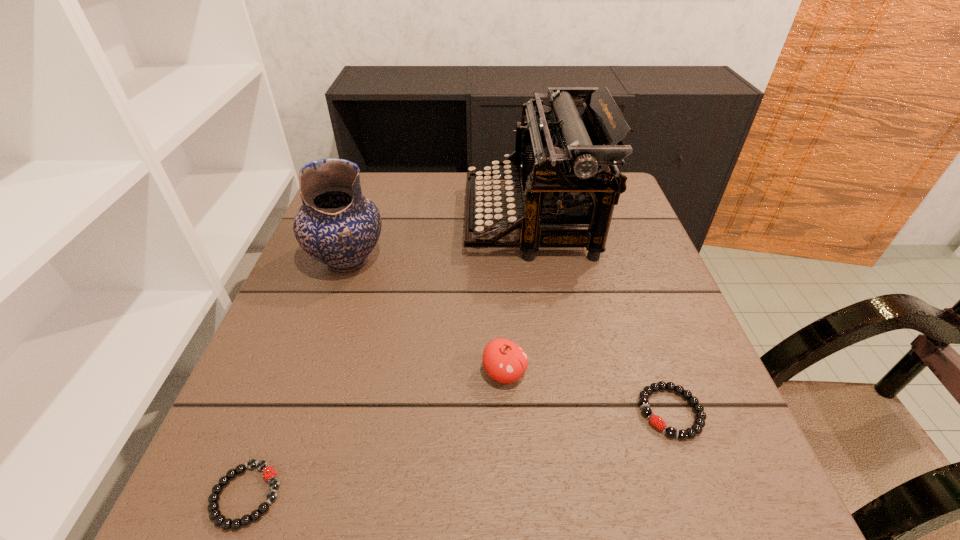
Locate an element on the screen. The height and width of the screenshot is (540, 960). free space located 0.280m on the back of the third tallest object is located at coordinates (499, 261).

Find the location of a particular element. The height and width of the screenshot is (540, 960). vacant point located on the left of the farther bracelet is located at coordinates (455, 412).

This screenshot has height=540, width=960. Find the location of `vacant space situated 0.070m on the right of the nearest object`. vacant space situated 0.070m on the right of the nearest object is located at coordinates [328, 495].

You are a GUI agent. You are given a task and a screenshot of the screen. Output one action in this format:
    pyautogui.click(x=<x>, y=<y>)
    Task: Click on the object located at the far edge
    The height and width of the screenshot is (540, 960).
    Given the screenshot: What is the action you would take?
    pyautogui.click(x=565, y=162)

Find the location of `object located at the near edge`. object located at the near edge is located at coordinates (269, 474).

Where is `pottery that is at the left edge`? pottery that is at the left edge is located at coordinates (336, 225).

Where is `bracelet that is at the left edge`? This screenshot has width=960, height=540. bracelet that is at the left edge is located at coordinates (269, 474).

Identify the location of typewriter that is positioned at the right edge. This screenshot has height=540, width=960. (565, 162).

Where is `bracelet that is at the right edge`? bracelet that is at the right edge is located at coordinates (699, 422).

Identify the location of object at the near left corner. (269, 474).